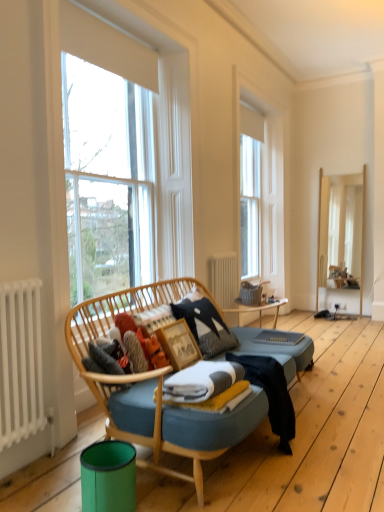
What is the approximate width of white metallic radiator at left, which is the 1th radiator in left-to-right order?

white metallic radiator at left, which is the 1th radiator in left-to-right order, is 13.95 centimeters in width.

Where is `fluffy fabric laundry at center`? This screenshot has width=384, height=512. fluffy fabric laundry at center is located at coordinates (122, 350).

What do you see at coordinates (341, 242) in the screenshot? This screenshot has width=384, height=512. I see `wooden mirror at right` at bounding box center [341, 242].

In order to face wooden mirror at right, should I rotate leftwards or rightwards?

Turn right approximately 19.131 degrees to face it.

This screenshot has width=384, height=512. Find the location of `white metallic radiator at left, which is the 1th radiator in left-to-right order`. white metallic radiator at left, which is the 1th radiator in left-to-right order is located at coordinates (20, 361).

Between fluffy orange plush at center and green fabric trash bin at lower left, which one has larger size?

green fabric trash bin at lower left is bigger.

Is fluffy orange plush at center in front of green fabric trash bin at lower left?

No, the depth of fluffy orange plush at center is greater than that of green fabric trash bin at lower left.

From the image's perspective, does fluffy orange plush at center appear lower than green fabric trash bin at lower left?

No.

Is fluffy orange plush at center turned away from green fabric trash bin at lower left?

No, fluffy orange plush at center is not facing away from green fabric trash bin at lower left.

Does point (120, 104) come farther from viewer compared to point (209, 309)?

Yes, it is behind point (209, 309).

At what (x,y) coordinates should I click in order to perform the action: click on pillow on the right of the clear glass window at left. Please return your answer as a coordinate pair (x, y). The height and width of the screenshot is (512, 384). Looking at the image, I should click on tap(205, 325).

Is clear glass window at left oriented away from textured gray pillow at center?

Yes, textured gray pillow at center is at the back of clear glass window at left.

Is textured gray pillow at center surrounded by clear glass window at left?

Actually, textured gray pillow at center is outside clear glass window at left.

Is textured gray pillow at center turned away from clear glass window at left?

Yes, textured gray pillow at center is positioned with its back facing clear glass window at left.

Considering the points (197, 311) and (102, 50), which point is in front, point (197, 311) or point (102, 50)?

The point (102, 50) is closer.

Considering the relative sizes of textured gray pillow at center and clear glass window at left in the image provided, is textured gray pillow at center shorter than clear glass window at left?

Yes, textured gray pillow at center is shorter than clear glass window at left.

Can you tell me how much textured gray pillow at center and clear glass window at left differ in facing direction?

0.408 degrees separate the facing orientations of textured gray pillow at center and clear glass window at left.

Is clear glass window at left positioned in front of white radiator at center, the second radiator in the front-to-back sequence?

Yes, clear glass window at left is closer to the camera.

Considering the positions of points (113, 200) and (219, 261), is point (113, 200) closer to camera compared to point (219, 261)?

That is True.

From a real-world perspective, is clear glass window at left located beneath white radiator at center, which ranks as the 2th radiator in left-to-right order?

No, from a real-world perspective, clear glass window at left is not under white radiator at center, which ranks as the 2th radiator in left-to-right order.

Is clear glass window at left placed right next to white radiator at center, the 1th radiator from the back?

No, clear glass window at left is not making contact with white radiator at center, the 1th radiator from the back.

Find the location of a particular element. This screenshot has width=384, height=512. pillow behind the fluffy fabric laundry at center is located at coordinates (205, 325).

Who is shorter, fluffy fabric laundry at center or textured gray pillow at center?

Standing shorter between the two is fluffy fabric laundry at center.

Does fluffy fabric laundry at center have a smaller size compared to textured gray pillow at center?

Yes, fluffy fabric laundry at center is smaller than textured gray pillow at center.

Considering the sizes of objects fluffy orange plush at center and white wood window frame at upper center in the image provided, who is thinner, fluffy orange plush at center or white wood window frame at upper center?

white wood window frame at upper center is thinner.

Are fluffy orange plush at center and white wood window frame at upper center located far from each other?

Yes, fluffy orange plush at center and white wood window frame at upper center are quite far apart.

From the image's perspective, is fluffy orange plush at center positioned above or below white wood window frame at upper center?

Based on their image positions, fluffy orange plush at center is located beneath white wood window frame at upper center.

Identify the location of window frame above the fluffy orange plush at center (from the image's perspective). (263, 181).

In the scene shown: Does wooden mirror at right have a smaller size compared to wooden picture frame at center?

No, wooden mirror at right is not smaller than wooden picture frame at center.

Is wooden mirror at right far from wooden picture frame at center?

That's right, there is a large distance between wooden mirror at right and wooden picture frame at center.

Is wooden mirror at right inside or outside of wooden picture frame at center?

The correct answer is: outside.

Considering the sizes of objects wooden mirror at right and wooden picture frame at center in the image provided, who is wider, wooden mirror at right or wooden picture frame at center?

Wider between the two is wooden mirror at right.

What are the coordinates of `trash bin/can lying in front of the fluffy orange plush at center` in the screenshot? It's located at (108, 477).

Find the location of a particular element. pillow behind the clear glass window at left is located at coordinates (205, 325).

From the image, which object appears to be farther from white wood window frame at upper center, wooden picture frame at center or wooden mirror at right?

Among the two, wooden picture frame at center is located further to white wood window frame at upper center.

Looking at the image, which one is located closer to white radiator at center, which ranks as the 2th radiator in left-to-right order, textured gray pillow at center or fluffy fabric laundry at center?

textured gray pillow at center.

Estimate the real-world distances between objects in this image. Which object is further from fluffy orange plush at center, green fabric trash bin at lower left or fluffy fabric laundry at center?

The object further to fluffy orange plush at center is green fabric trash bin at lower left.

Looking at the image, which one is located further to white metallic radiator at left, the second radiator in the right-to-left sequence, white radiator at center, the 1th radiator from the back, or green fabric trash bin at lower left?

white radiator at center, the 1th radiator from the back.

Estimate the real-world distances between objects in this image. Which object is closer to textured gray pillow at center, white radiator at center, the second radiator in the front-to-back sequence, or fluffy fabric laundry at center?

Among the two, fluffy fabric laundry at center is located nearer to textured gray pillow at center.

Estimate the real-world distances between objects in this image. Which object is closer to clear glass window at left, fluffy orange plush at center or white metallic radiator at left, arranged as the second radiator when viewed from the back?

Among the two, white metallic radiator at left, arranged as the second radiator when viewed from the back, is located nearer to clear glass window at left.

When comparing their distances from textured gray pillow at center, does fluffy fabric laundry at center or fluffy orange plush at center seem further?

Among the two, fluffy fabric laundry at center is located further to textured gray pillow at center.

Which object lies further to the anchor point textured gray pillow at center, white metallic radiator at left, the second radiator in the right-to-left sequence, or wooden mirror at right?

wooden mirror at right lies further to textured gray pillow at center than the other object.

Identify the location of toy between green fabric trash bin at lower left and white wood window frame at upper center along the z-axis. (152, 350).

Find the location of `window located between green fabric trash bin at lower left and white radiator at center, which ranks as the 2th radiator in left-to-right order, in the depth direction`. window located between green fabric trash bin at lower left and white radiator at center, which ranks as the 2th radiator in left-to-right order, in the depth direction is located at coordinates (123, 159).

Locate an element on the screen. The height and width of the screenshot is (512, 384). laundry between clear glass window at left and white wood window frame at upper center in the front-back direction is located at coordinates (122, 350).

Locate an element on the screen. laundry positioned between green fabric trash bin at lower left and fluffy orange plush at center from near to far is located at coordinates tap(122, 350).